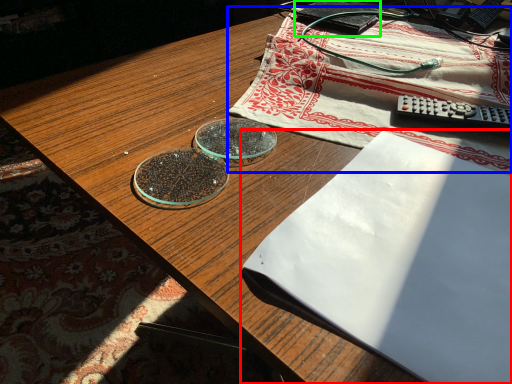
Question: Which is nearer to the notebook (highlighted by a red box)? tablecloth (highlighted by a blue box) or paperback book (highlighted by a green box).

Choices:
 (A) tablecloth
 (B) paperback book

Answer: (A)